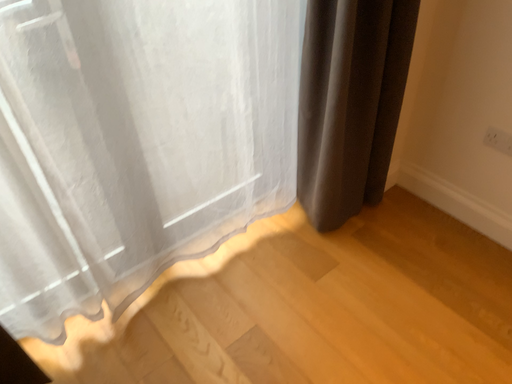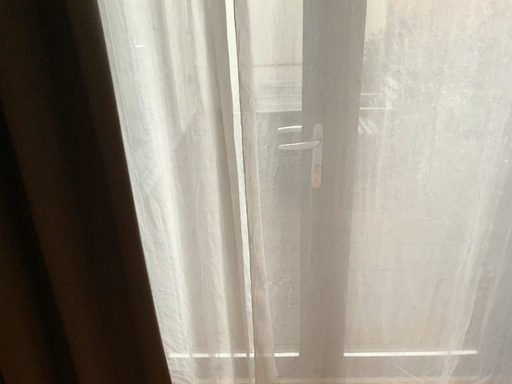
Question: Which way did the camera rotate in the video?

Choices:
 (A) rotated downward
 (B) rotated upward

Answer: (B)